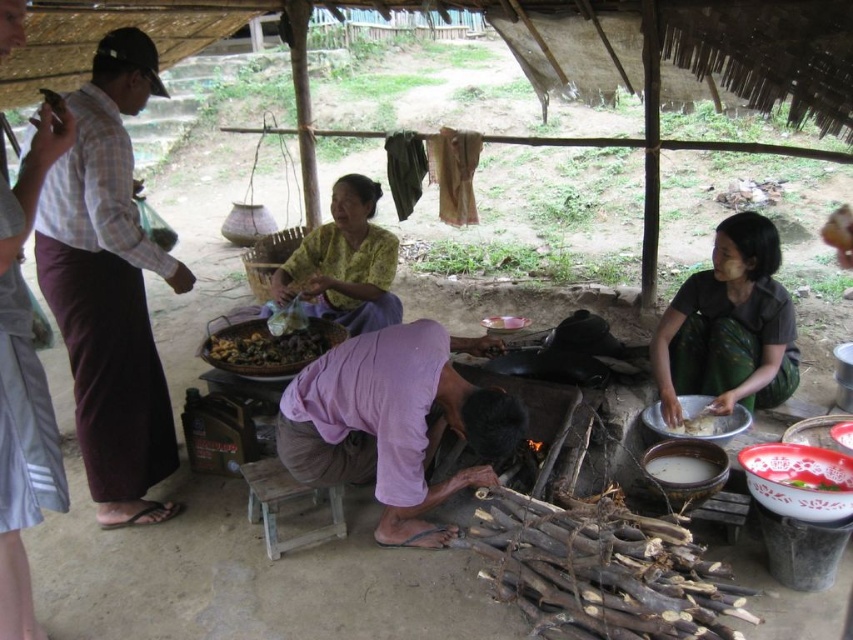
You are a visitor in this rural cooking area and need to place a new ingredient on the nearest available surface. The wooden stool at center has a surface area of 0.3 square meters, and the white glossy bowl at lower right is partially filled with liquid. Which object should you use to place the ingredient?

The wooden stool at center has a surface area of 0.3 square meters and is in front of the white glossy bowl at lower right, so you should place the ingredient on the wooden stool at center to avoid spilling the liquid in the white glossy bowl at lower right.

You are a visitor in this rural cooking area and need to locate the white matte rice bowl at center. According to the scene description, where should you look relative to the purple cotton shirt at center?

The white matte rice bowl at center is to the right of the purple cotton shirt at center.

You are standing in the rural outdoor cooking scene under the bamboo shelter. There are two points marked in the image. Which point, point 1 at coordinates (x=340, y=385) or point 2 at coordinates (x=527, y=321), is closer to you?

Point 1 at coordinates (x=340, y=385) is closer to you than point 2 at coordinates (x=527, y=321).